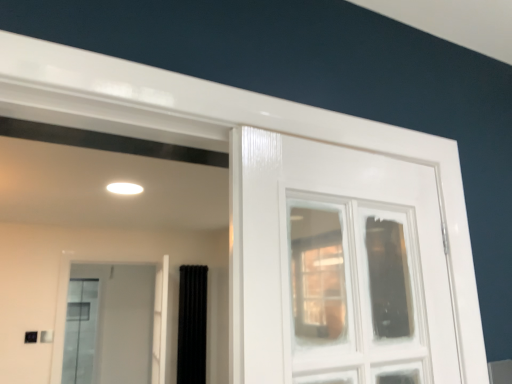
Question: Is clear glass screen door at upper left oriented towards clear glass window at center?

Choices:
 (A) no
 (B) yes

Answer: (B)

Question: Considering the relative positions of clear glass screen door at upper left and clear glass window at center in the image provided, is clear glass screen door at upper left in front of clear glass window at center?

Choices:
 (A) no
 (B) yes

Answer: (A)

Question: Is clear glass screen door at upper left located outside clear glass window at center?

Choices:
 (A) yes
 (B) no

Answer: (A)

Question: Is clear glass screen door at upper left to the left of clear glass window at center from the viewer's perspective?

Choices:
 (A) no
 (B) yes

Answer: (B)

Question: Would you say clear glass window at center is part of clear glass screen door at upper left's contents?

Choices:
 (A) yes
 (B) no

Answer: (B)

Question: Does clear glass screen door at upper left have a lesser height compared to clear glass window at center?

Choices:
 (A) yes
 (B) no

Answer: (B)

Question: Does black velvet curtain at center have a greater height compared to clear glass screen door at upper left?

Choices:
 (A) yes
 (B) no

Answer: (B)

Question: From the image's perspective, would you say black velvet curtain at center is shown under clear glass screen door at upper left?

Choices:
 (A) no
 (B) yes

Answer: (B)

Question: Is black velvet curtain at center shorter than clear glass screen door at upper left?

Choices:
 (A) yes
 (B) no

Answer: (A)

Question: Are black velvet curtain at center and clear glass screen door at upper left located far from each other?

Choices:
 (A) no
 (B) yes

Answer: (B)

Question: Is black velvet curtain at center facing towards clear glass screen door at upper left?

Choices:
 (A) no
 (B) yes

Answer: (A)

Question: Is black velvet curtain at center thinner than clear glass screen door at upper left?

Choices:
 (A) yes
 (B) no

Answer: (B)

Question: Does clear glass window at center appear on the right side of black velvet curtain at center?

Choices:
 (A) yes
 (B) no

Answer: (A)